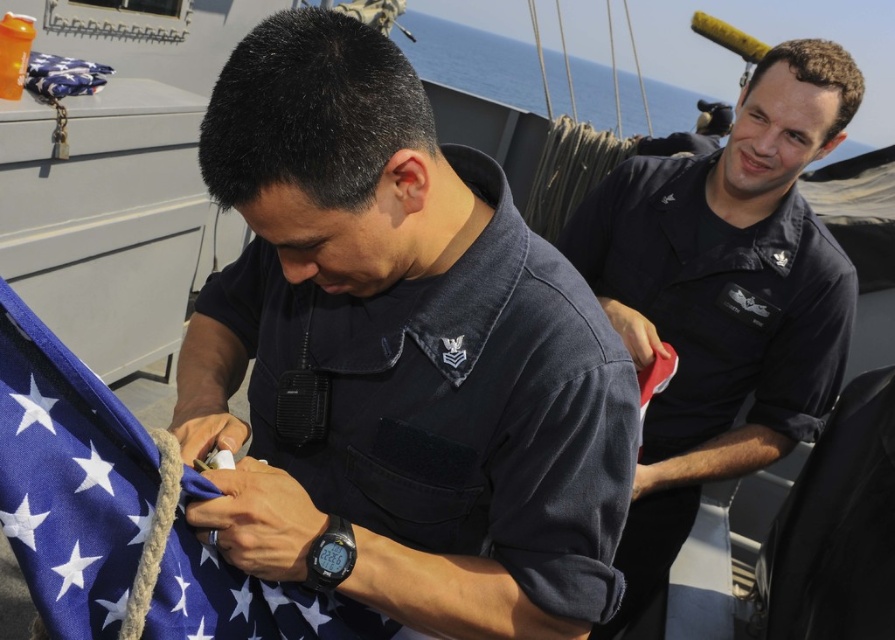
Question: Is dark blue uniform at upper right above blue fabric flag at center?

Choices:
 (A) yes
 (B) no

Answer: (A)

Question: Is dark blue uniform at center below blue fabric flag at center?

Choices:
 (A) yes
 (B) no

Answer: (B)

Question: Which point is closer to the camera taking this photo?

Choices:
 (A) (47, 435)
 (B) (193, 508)

Answer: (A)

Question: Among these objects, which one is farthest from the camera?

Choices:
 (A) blue fabric flag at center
 (B) dark blue uniform at upper right
 (C) dark blue uniform at center

Answer: (B)

Question: Which of the following is the farthest from the observer?

Choices:
 (A) blue fabric flag at center
 (B) dark blue uniform at upper right

Answer: (B)

Question: Can you confirm if dark blue uniform at center is positioned below blue fabric flag at center?

Choices:
 (A) yes
 (B) no

Answer: (B)